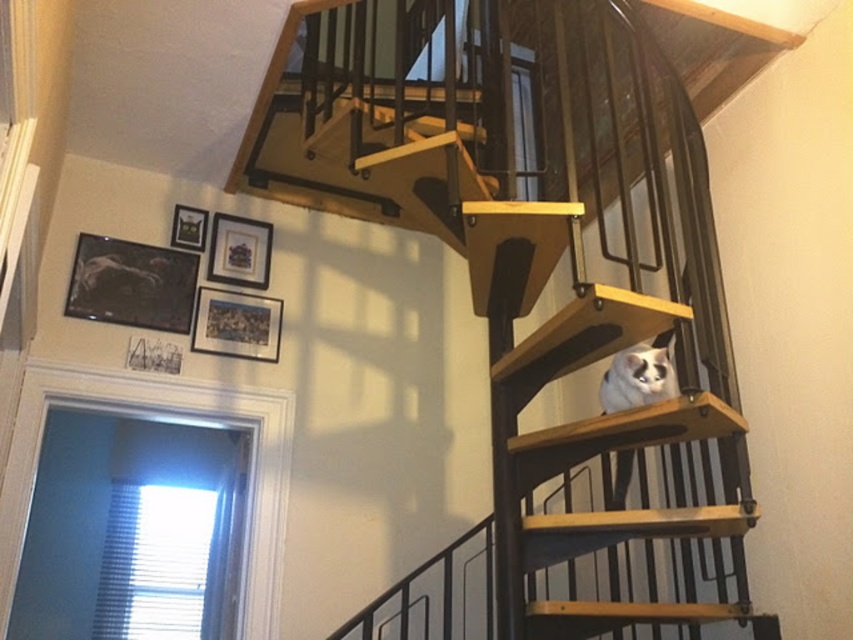
Does wooden stairs at center appear on the right side of white fur cat at upper right?

No, wooden stairs at center is not to the right of white fur cat at upper right.

Who is positioned more to the right, wooden stairs at center or white fur cat at upper right?

white fur cat at upper right is more to the right.

You are a GUI agent. You are given a task and a screenshot of the screen. Output one action in this format:
    pyautogui.click(x=<x>, y=<y>)
    Task: Click on the wooden stairs at center
    The width and height of the screenshot is (853, 640).
    Given the screenshot: What is the action you would take?
    pyautogui.click(x=543, y=276)